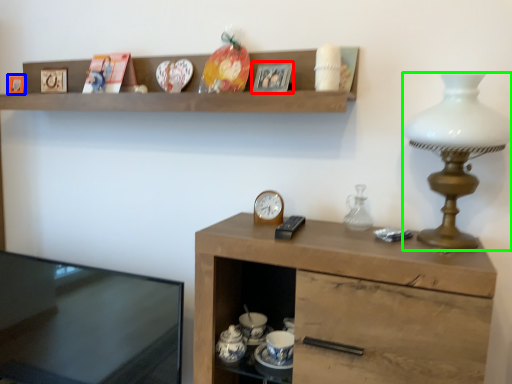
Question: Which object is the farthest from picture frame (highlighted by a red box)? Choose among these: picture frame (highlighted by a blue box) or lamp (highlighted by a green box).

Choices:
 (A) picture frame
 (B) lamp

Answer: (A)